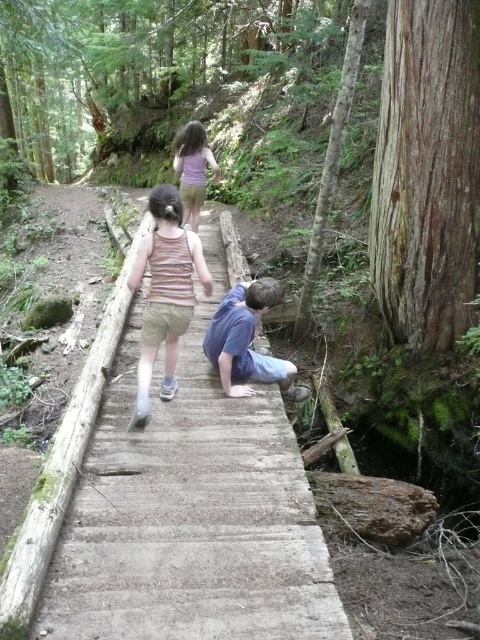
You are a photographer trying to capture both the striped tank top at center and the purple matte shirt at upper center in the same frame. Considering their sizes, which one should you focus on to ensure both fit in the photo?

The striped tank top at center is larger in width than the purple matte shirt at upper center, so focusing on the larger striped tank top at center will help ensure both fit within the frame.

Based on the scene description and the objects provided, where is the blue cotton shirt at center located in terms of coordinates?

The blue cotton shirt at center is located at the coordinates point (x=244, y=339).